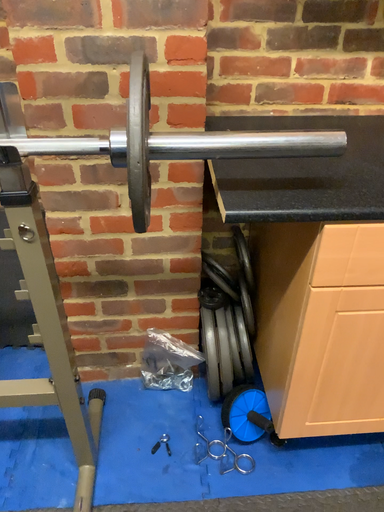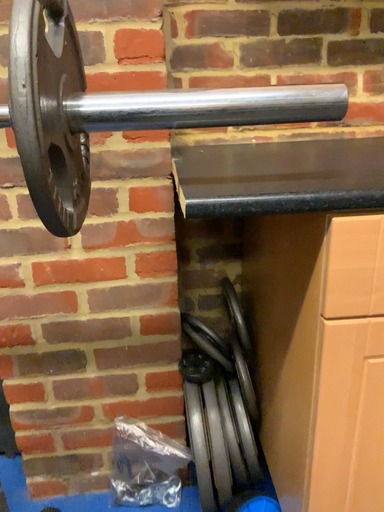
Question: Which way did the camera rotate in the video?

Choices:
 (A) rotated downward
 (B) rotated upward

Answer: (B)